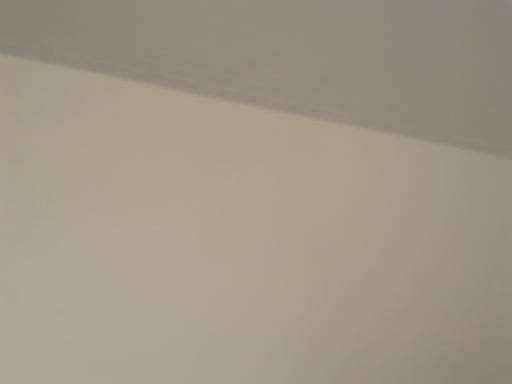
Measure the distance between point (x=480, y=103) and camera.

Point (x=480, y=103) and camera are 1.06 meters apart.

The height and width of the screenshot is (384, 512). I want to click on white matte wall at upper left, so click(x=298, y=56).

What do you see at coordinates (298, 56) in the screenshot? This screenshot has width=512, height=384. I see `white matte wall at upper left` at bounding box center [298, 56].

At what (x,y) coordinates should I click in order to perform the action: click on white matte wall at upper left. Please return your answer as a coordinate pair (x, y). The image size is (512, 384). Looking at the image, I should click on (298, 56).